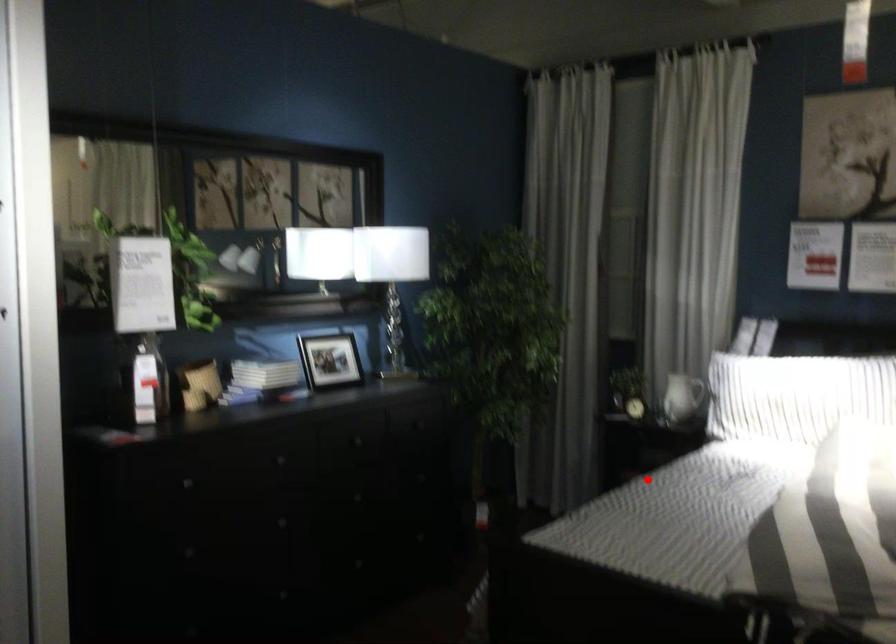
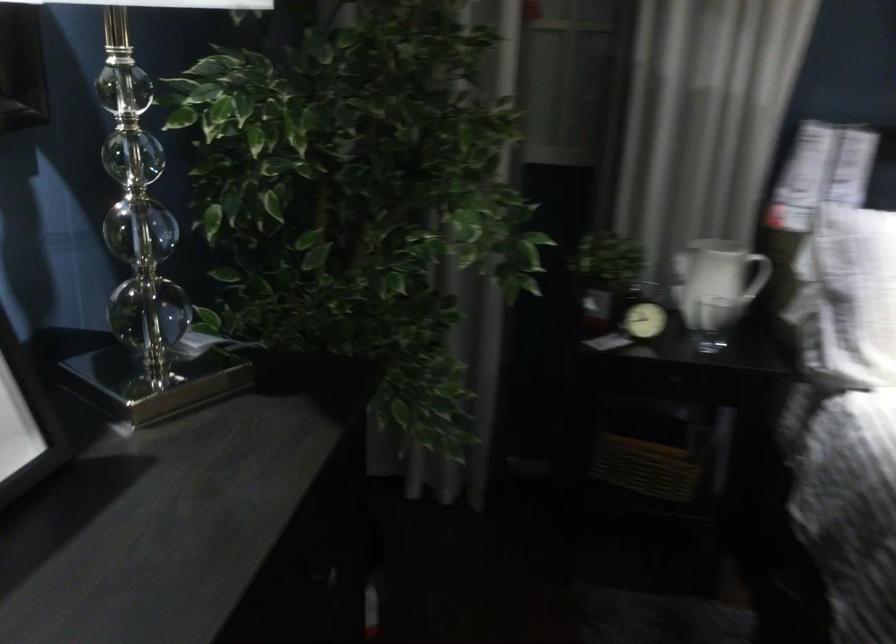
Question: I am providing you with two images of the same scene from different viewpoints. Image1 has a red point marked. In image2, the corresponding 3D location appears at what relative position? Reply with the corresponding letter.

Choices:
 (A) Closer
 (B) Farther

Answer: (A)